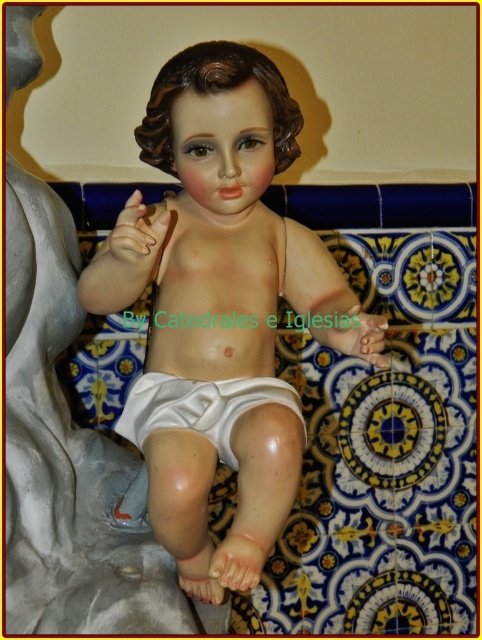
You are standing 1.2 meters away from the statue of the baby. There is a point at coordinates point (267, 228). Can you reach that point with your hand without moving closer to the statue?

The distance of point (267, 228) from viewer is 1.06 meters. Since you are standing 1.2 meters away from the statue, the point is closer to you than your current position. Therefore, you can reach the point with your hand without moving closer.

You are an art conservator examining the statue of the baby. You notice a specific point at coordinates point (221, 312). What does this point indicate about the statue?

The point (221, 312) marks the location of the smooth porcelain doll at center, indicating that this area has a smooth, porcelain texture typical of the statue.